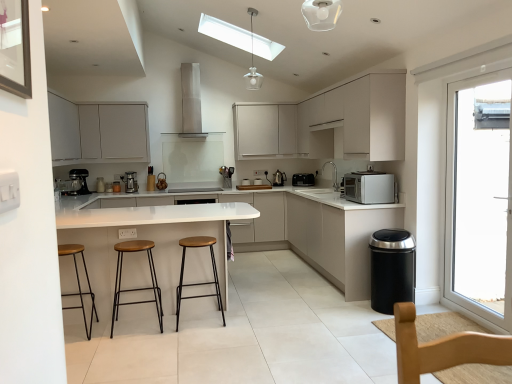
Find the location of a particular element. The image size is (512, 384). vacant space to the right of wooden seat stool at center, arranged as the 3th stool when viewed from the left is located at coordinates (246, 319).